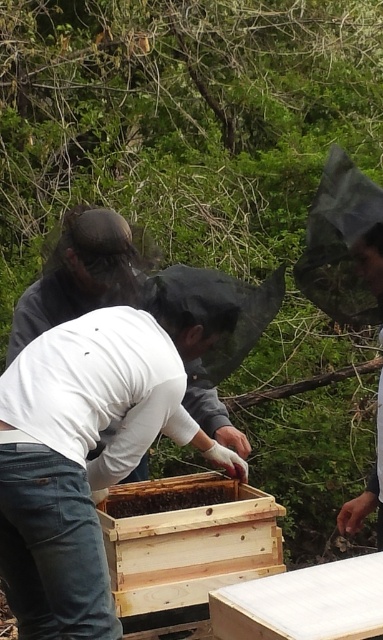
Please provide the 2D coordinates of the wooden beehive at center in the image. The coordinates should be in the format of a point with two decimal places, such as 0.5,0.5.

The wooden beehive at center is located at point (186,540).

You are a beekeeper wearing a white matte shirt at center and need to access the brown wooden beehive at center. Which direction should you move to reach the hive?

The white matte shirt at center is positioned on the left side of the brown wooden beehive at center, so you should move to the right to reach the hive.